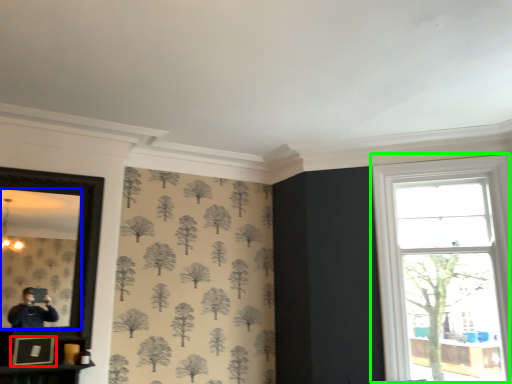
Question: Considering the real-world distances, which object is closest to picture frame (highlighted by a red box)? mirror (highlighted by a blue box) or window (highlighted by a green box).

Choices:
 (A) mirror
 (B) window

Answer: (A)